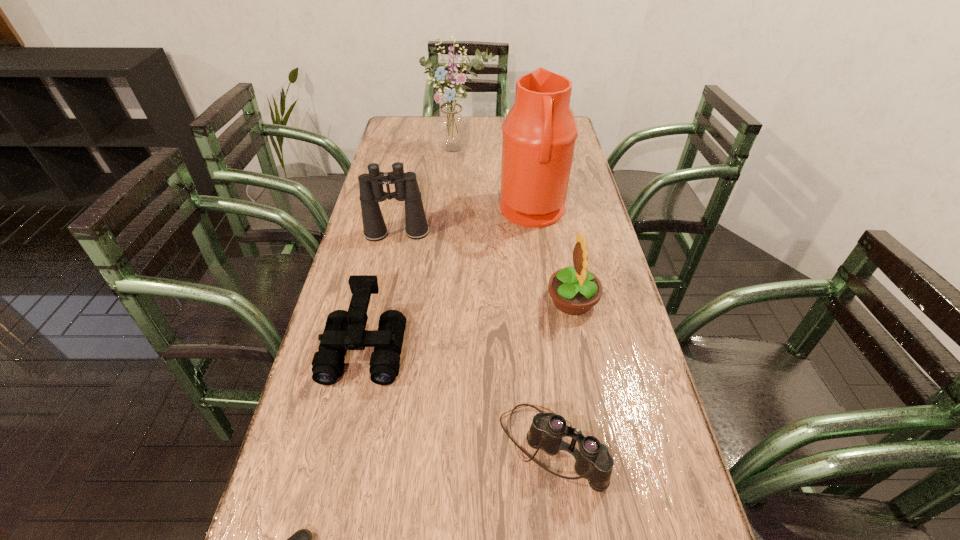
The height and width of the screenshot is (540, 960). I want to click on the farthest object, so click(x=451, y=125).

Locate an element on the screen. The width and height of the screenshot is (960, 540). water jug is located at coordinates (539, 133).

At what (x,y) coordinates should I click in order to perform the action: click on the farthest binoculars. Please return your answer as a coordinate pair (x, y). Looking at the image, I should click on (371, 188).

Find the location of a particular element. The height and width of the screenshot is (540, 960). sunflower is located at coordinates (574, 290).

This screenshot has height=540, width=960. Find the location of `the second nearest binoculars`. the second nearest binoculars is located at coordinates (344, 330).

Locate an element on the screen. This screenshot has height=540, width=960. the third shortest object is located at coordinates (344, 330).

The image size is (960, 540). Identify the location of the sixth tallest object. (594, 462).

Locate an element on the screen. This screenshot has width=960, height=540. the nearest binoculars is located at coordinates (594, 462).

Identify the location of vacant region located on the front-facing side of the farthest object. The height and width of the screenshot is (540, 960). (458, 175).

In order to click on vacant area located from the spout of the water jug in this screenshot , I will do `click(453, 212)`.